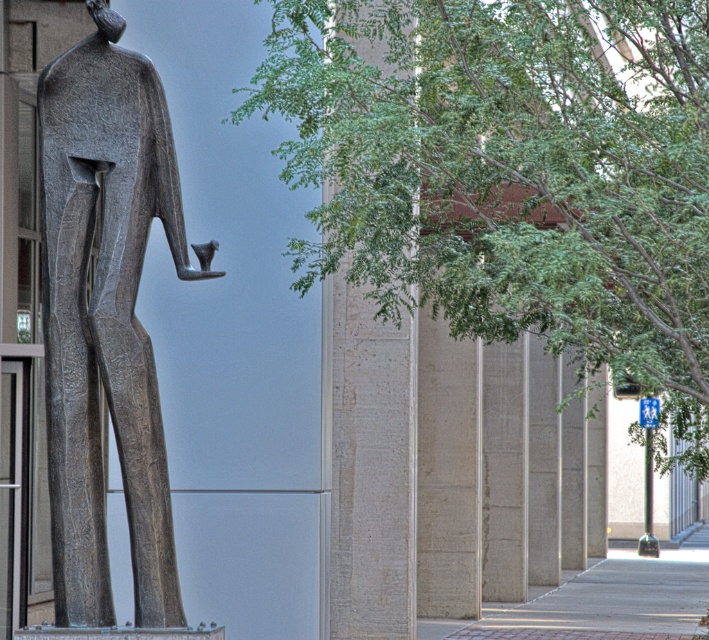
You are a city planner evaluating the urban space shown. You need to determine if the green leafy tree at center can provide shade to the bronze statue at left during midday. Based on their sizes and positions, what is your assessment?

The green leafy tree at center has a larger size compared to bronze statue at left. Since the tree is positioned centrally and is larger, it is likely that its canopy can cast shade over the bronze statue at left during midday when the sun is overhead.

You are standing at the center of the urban setting. The bronze statue at left is located at coordinates point 0.498, 0.151. If you face the statue, which direction should you turn to align yourself with the row of light colored concrete pillars to your right?

The bronze statue at left is located at point (106, 317). Since the pillars are to the right of the statue, you should turn to your right to face the pillars.

You are standing in the urban setting described. There is a green leafy tree at center represented by point (510, 172). The bronze statue is on the left side. If you face the bronze statue, which direction should you turn to find the green leafy tree at center?

The green leafy tree at center is located to the right of the bronze statue. Since you are facing the bronze statue, you should turn to your right to find the green leafy tree at center.